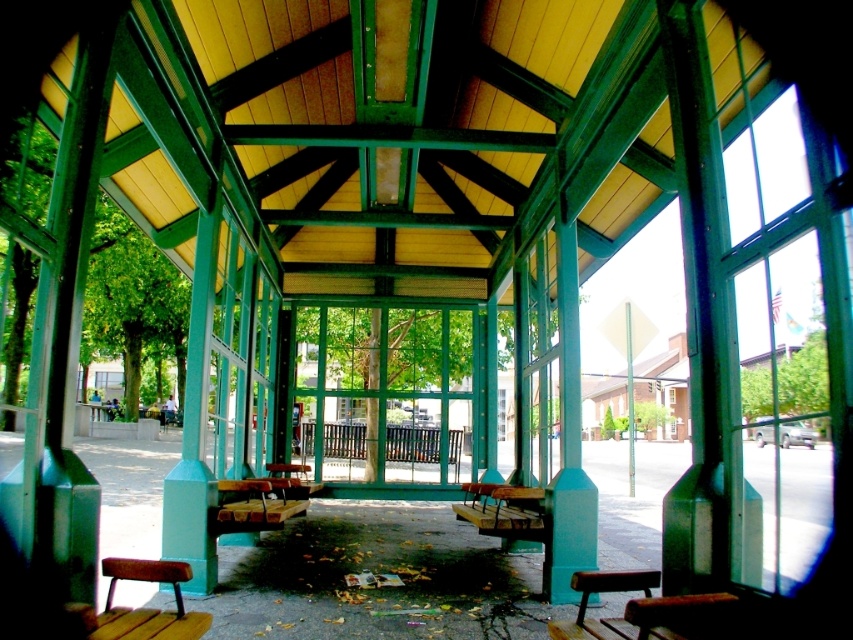
Who is positioned more to the right, wooden bench at lower right or wooden park bench at lower left?

wooden bench at lower right is more to the right.

Between point (672, 618) and point (144, 634), which one is positioned in front?

Point (672, 618)

Identify the location of wooden bench at lower right. (635, 608).

Does clear glass window at right have a smaller size compared to wooden park bench at lower left?

No.

Does clear glass window at right appear over wooden park bench at lower left?

Yes, clear glass window at right is above wooden park bench at lower left.

Does point (755, 252) come behind point (184, 621)?

Yes, point (755, 252) is farther from viewer.

The height and width of the screenshot is (640, 853). Find the location of `clear glass window at right`. clear glass window at right is located at coordinates (787, 337).

Is clear glass window at right wider than wooden bench at lower right?

Indeed, clear glass window at right has a greater width compared to wooden bench at lower right.

Is point (805, 317) positioned after point (578, 624)?

Yes, point (805, 317) is farther from viewer.

You are a GUI agent. You are given a task and a screenshot of the screen. Output one action in this format:
    pyautogui.click(x=<x>, y=<y>)
    Task: Click on the clear glass window at right
    
    Given the screenshot: What is the action you would take?
    pyautogui.click(x=787, y=337)